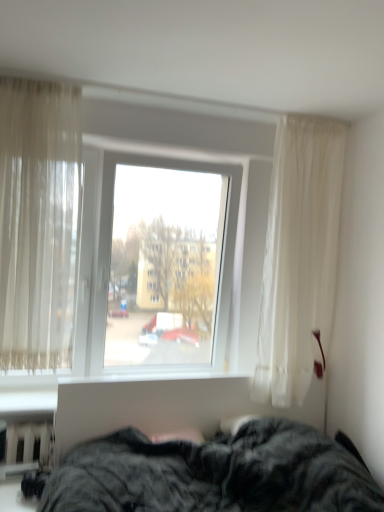
Question: Considering the relative positions of transparent glass window at center and white plastic radiator at lower left in the image provided, is transparent glass window at center to the right of white plastic radiator at lower left from the viewer's perspective?

Choices:
 (A) no
 (B) yes

Answer: (B)

Question: Is transparent glass window at center positioned far away from white plastic radiator at lower left?

Choices:
 (A) no
 (B) yes

Answer: (B)

Question: Is the position of transparent glass window at center more distant than that of white plastic radiator at lower left?

Choices:
 (A) no
 (B) yes

Answer: (B)

Question: From the image's perspective, is transparent glass window at center located above white plastic radiator at lower left?

Choices:
 (A) no
 (B) yes

Answer: (B)

Question: Can you confirm if transparent glass window at center is smaller than white plastic radiator at lower left?

Choices:
 (A) no
 (B) yes

Answer: (A)

Question: Can white plastic radiator at lower left be found inside transparent glass window at center?

Choices:
 (A) no
 (B) yes

Answer: (A)

Question: From a real-world perspective, is sheer beige curtain at left below white plastic radiator at lower left?

Choices:
 (A) no
 (B) yes

Answer: (A)

Question: Considering the relative sizes of sheer beige curtain at left and white plastic radiator at lower left in the image provided, is sheer beige curtain at left thinner than white plastic radiator at lower left?

Choices:
 (A) no
 (B) yes

Answer: (A)

Question: Does sheer beige curtain at left have a larger size compared to white plastic radiator at lower left?

Choices:
 (A) no
 (B) yes

Answer: (B)

Question: Is sheer beige curtain at left positioned beyond the bounds of white plastic radiator at lower left?

Choices:
 (A) yes
 (B) no

Answer: (A)

Question: Can you confirm if sheer beige curtain at left is shorter than white plastic radiator at lower left?

Choices:
 (A) no
 (B) yes

Answer: (A)

Question: Is sheer beige curtain at left closer to camera compared to white plastic radiator at lower left?

Choices:
 (A) no
 (B) yes

Answer: (B)

Question: Is dark gray plush bed at lower center behind sheer beige curtain at left?

Choices:
 (A) yes
 (B) no

Answer: (B)